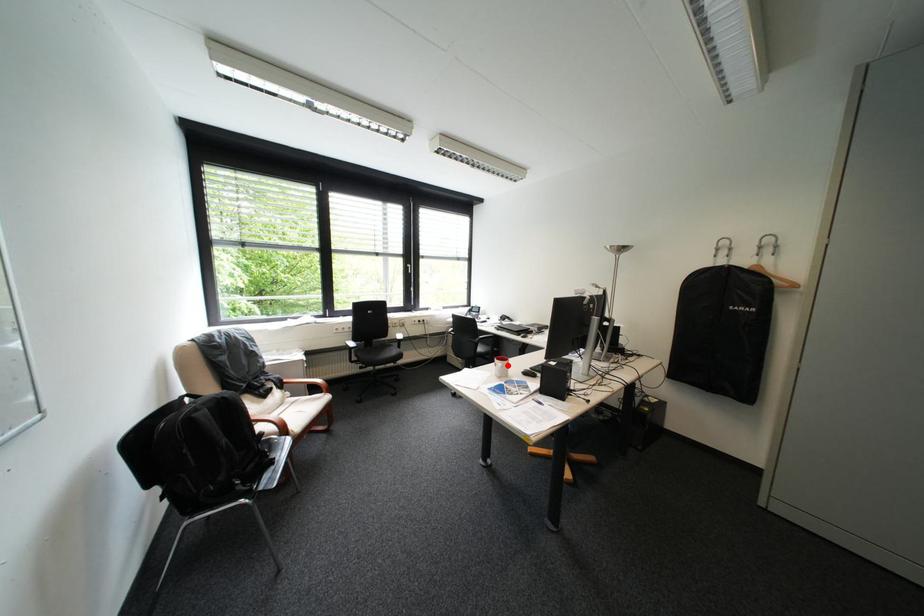
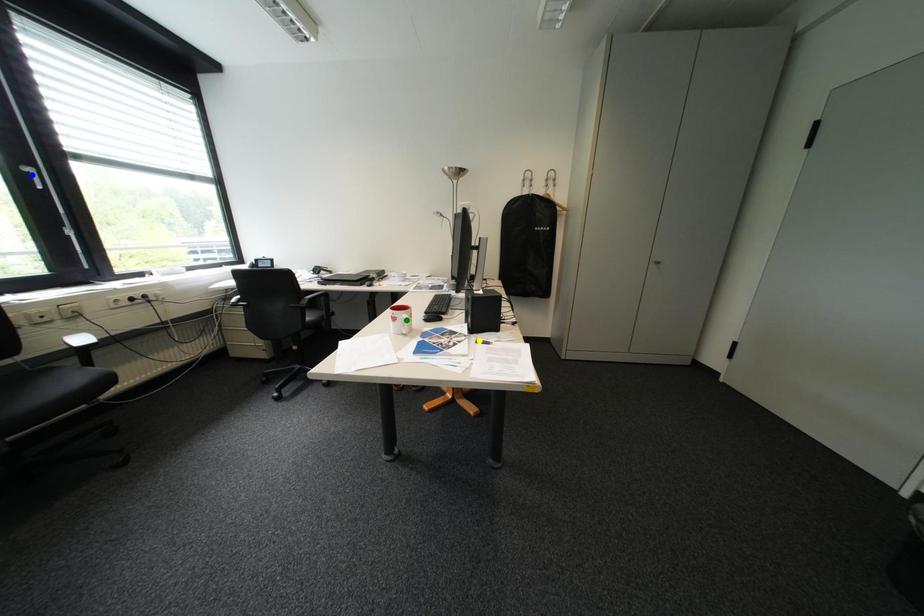
Question: I am providing you with two images of the same scene from different viewpoints. A red point is marked on the first image. You are given multiple points on the second image. Which mark in image 2 goes with the point in image 1?

Choices:
 (A) blue point
 (B) green point
 (C) yellow point

Answer: (B)